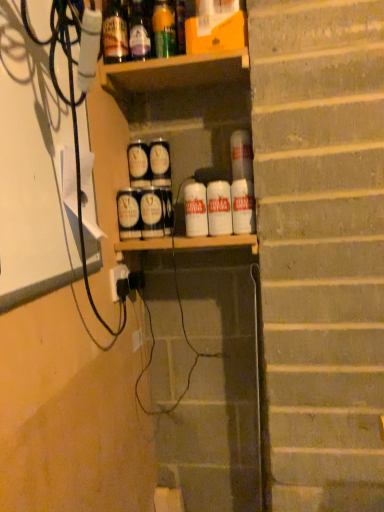
Question: Considering the relative positions of white matte can at center, the second beverage positioned from the right, and matte silver spray can at center, arranged as the 1th spray when viewed from the front, in the image provided, is white matte can at center, the second beverage positioned from the right, behind matte silver spray can at center, arranged as the 1th spray when viewed from the front,?

Choices:
 (A) no
 (B) yes

Answer: (A)

Question: Is white matte can at center, the 4th beverage when ordered from left to right, to the left of matte silver spray can at center, the 3th spray from the back, from the viewer's perspective?

Choices:
 (A) yes
 (B) no

Answer: (B)

Question: Does white matte can at center, the second beverage positioned from the right, appear on the right side of matte silver spray can at center, the 3th spray from the back?

Choices:
 (A) yes
 (B) no

Answer: (A)

Question: Is white matte can at center, the 4th beverage when ordered from left to right, in front of matte silver spray can at center, the 3th spray from the back?

Choices:
 (A) no
 (B) yes

Answer: (B)

Question: Considering the relative sizes of white matte can at center, the second beverage positioned from the right, and matte silver spray can at center, the 3th spray from the back, in the image provided, is white matte can at center, the second beverage positioned from the right, smaller than matte silver spray can at center, the 3th spray from the back,?

Choices:
 (A) yes
 (B) no

Answer: (A)

Question: Can you confirm if white matte can at center, the 4th beverage when ordered from left to right, is taller than matte silver spray can at center, arranged as the 1th spray when viewed from the front?

Choices:
 (A) no
 (B) yes

Answer: (A)

Question: From a real-world perspective, is white matte can at center, the 3th beverage from the right, located higher than white matte can at right, the 5th beverage positioned from the left?

Choices:
 (A) yes
 (B) no

Answer: (B)

Question: Is the depth of white matte can at center, positioned as the 3th beverage in left-to-right order, greater than that of white matte can at right, the 5th beverage positioned from the left?

Choices:
 (A) no
 (B) yes

Answer: (B)

Question: From the image's perspective, does white matte can at center, the 3th beverage from the right, appear lower than white matte can at right, which is counted as the first beverage, starting from the right?

Choices:
 (A) yes
 (B) no

Answer: (A)

Question: From the image's perspective, is white matte can at center, positioned as the 3th beverage in left-to-right order, on top of white matte can at right, the 5th beverage positioned from the left?

Choices:
 (A) no
 (B) yes

Answer: (A)

Question: Is white matte can at center, positioned as the 3th beverage in left-to-right order, touching white matte can at right, the 5th beverage positioned from the left?

Choices:
 (A) no
 (B) yes

Answer: (B)

Question: Is white matte can at center, the 3th beverage from the right, facing towards white matte can at right, which is counted as the first beverage, starting from the right?

Choices:
 (A) no
 (B) yes

Answer: (A)

Question: Is green glass bottle at upper center, which ranks as the 1th bottle in right-to-left order, positioned with its back to matte black cans at center, which is counted as the 2th spray, starting from the front?

Choices:
 (A) yes
 (B) no

Answer: (B)